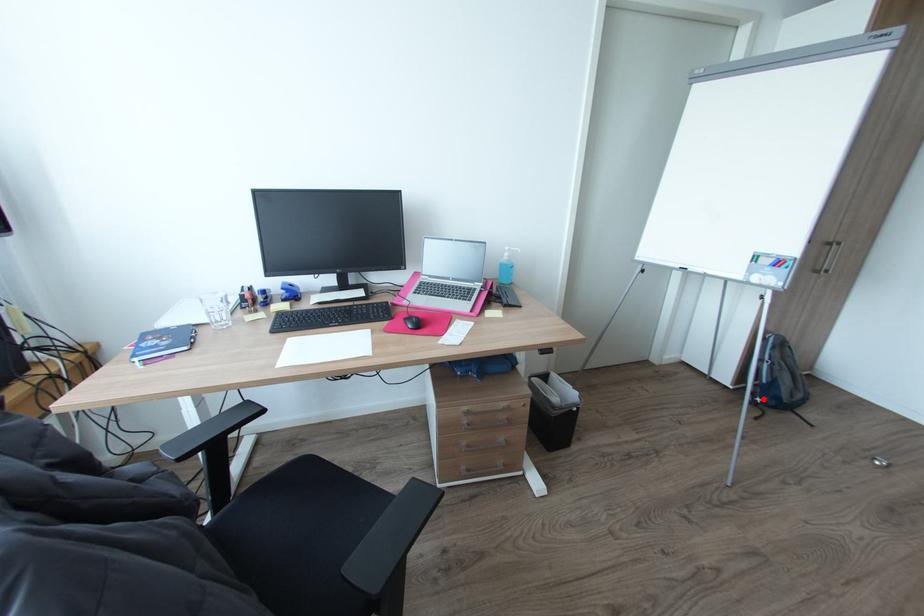
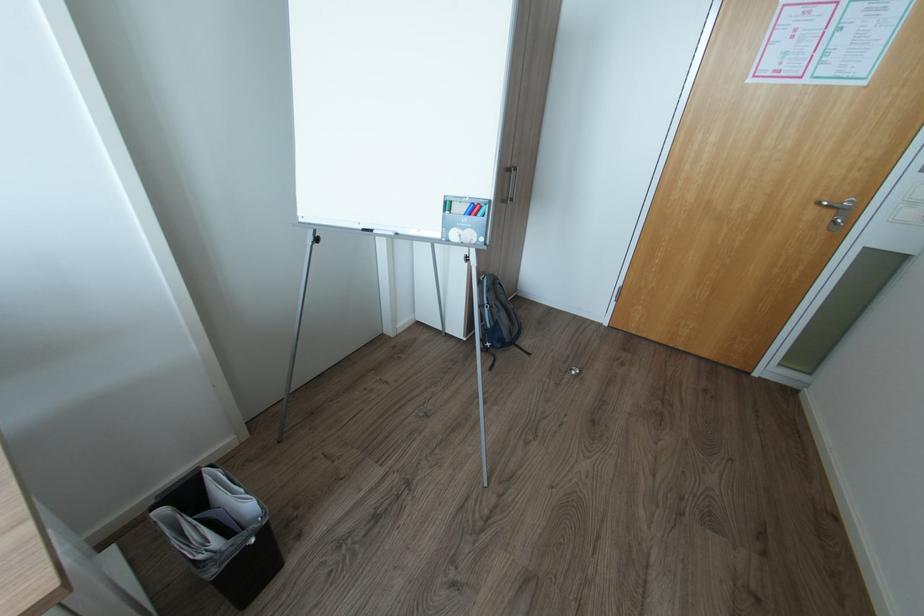
Question: I am providing you with two images of the same scene from different viewpoints. Image1 has a red point marked. In image2, the corresponding 3D location appears at what relative position? Reply with the corresponding letter.

Choices:
 (A) Closer
 (B) Farther

Answer: (A)